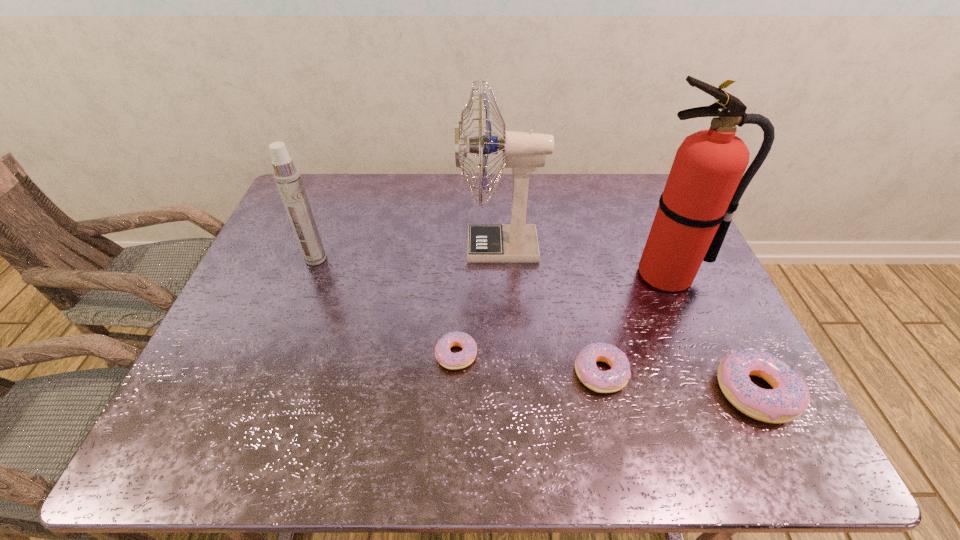
Identify the location of fire extinguisher present at the right edge. (705, 184).

Image resolution: width=960 pixels, height=540 pixels. I want to click on object present at the near right corner, so click(x=789, y=398).

In the image, there is a desktop. Where is `vacant area at the far edge`? Image resolution: width=960 pixels, height=540 pixels. vacant area at the far edge is located at coordinates (354, 186).

The width and height of the screenshot is (960, 540). Find the location of `vacant space at the near edge of the desktop`. vacant space at the near edge of the desktop is located at coordinates (451, 379).

Where is `free space at the left edge`? Image resolution: width=960 pixels, height=540 pixels. free space at the left edge is located at coordinates 276,244.

In order to click on vacant point at the far left corner in this screenshot , I will do `click(285, 210)`.

The height and width of the screenshot is (540, 960). In order to click on vacant space at the far right corner of the desktop in this screenshot , I will do `click(617, 190)`.

Find the location of `free point between the fire extinguisher and the fifth tallest object`. free point between the fire extinguisher and the fifth tallest object is located at coordinates (634, 324).

What are the coordinates of `empty location between the fourth object from left to right and the rightmost doughnut` in the screenshot? It's located at (678, 382).

You are a GUI agent. You are given a task and a screenshot of the screen. Output one action in this format:
    pyautogui.click(x=<x>, y=<y>)
    Task: Click on the vacant region between the fan and the fire extinguisher
    This screenshot has height=540, width=960.
    Given the screenshot: What is the action you would take?
    pyautogui.click(x=584, y=261)